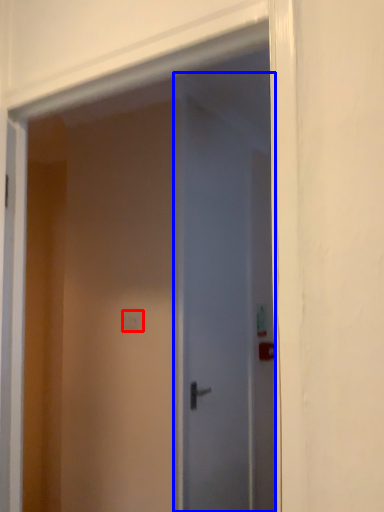
Question: Which of the following is the farthest to the observer, light switch (highlighted by a red box) or door (highlighted by a blue box)?

Choices:
 (A) light switch
 (B) door

Answer: (A)